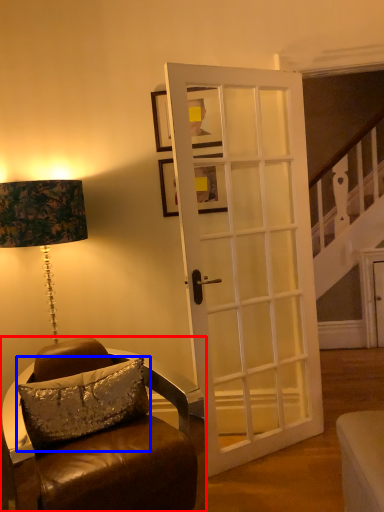
Question: Which of the following is the farthest to the observer, chair (highlighted by a red box) or pillow (highlighted by a blue box)?

Choices:
 (A) chair
 (B) pillow

Answer: (B)